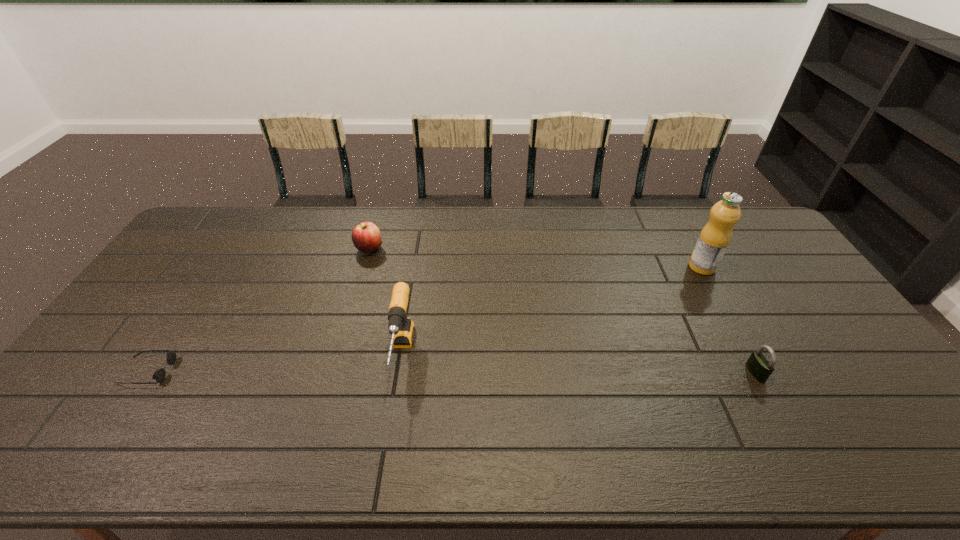
Where is `fruit juice`? fruit juice is located at coordinates (714, 238).

This screenshot has height=540, width=960. Find the location of `the tallest object`. the tallest object is located at coordinates (714, 238).

At what (x,y) coordinates should I click in order to perform the action: click on drill. Please return your answer as a coordinate pair (x, y). The height and width of the screenshot is (540, 960). Looking at the image, I should click on (402, 329).

Find the location of a particular element. The image size is (960, 540). the second tallest object is located at coordinates click(402, 329).

Image resolution: width=960 pixels, height=540 pixels. I want to click on the second object from left to right, so click(x=366, y=237).

This screenshot has height=540, width=960. I want to click on the farthest object, so click(x=366, y=237).

Locate an element on the screen. padlock is located at coordinates (757, 364).

At what (x,y) coordinates should I click in order to perform the action: click on the leftmost object. Please return your answer as a coordinate pair (x, y). Looking at the image, I should click on (159, 375).

This screenshot has height=540, width=960. I want to click on sunglasses, so click(x=159, y=375).

I want to click on vacant space located on the front label of the fruit juice, so click(x=568, y=267).